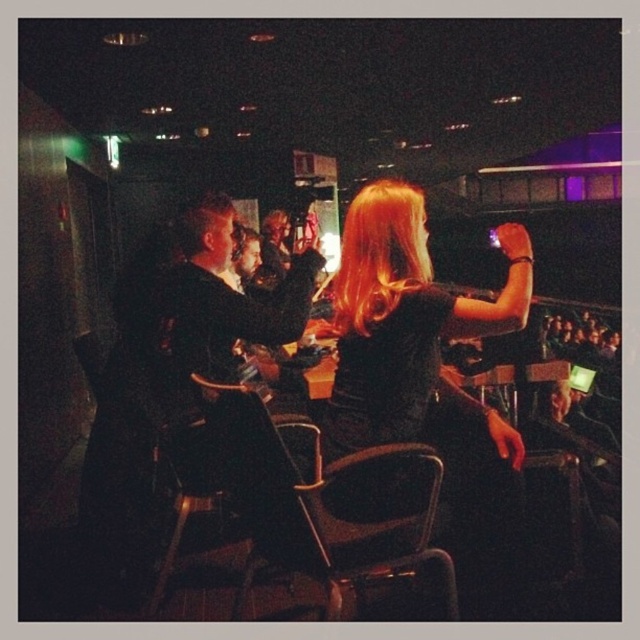
Question: Is black velvet dress at center below black leather chair at center?

Choices:
 (A) no
 (B) yes

Answer: (A)

Question: Which object is closer to the camera taking this photo?

Choices:
 (A) black velvet dress at center
 (B) black leather chair at center

Answer: (B)

Question: Can you confirm if black velvet dress at center is bigger than black leather chair at center?

Choices:
 (A) no
 (B) yes

Answer: (B)

Question: Among these points, which one is farthest from the camera?

Choices:
 (A) (339, 397)
 (B) (221, 397)

Answer: (A)

Question: Can you confirm if black velvet dress at center is positioned to the left of black leather chair at center?

Choices:
 (A) no
 (B) yes

Answer: (A)